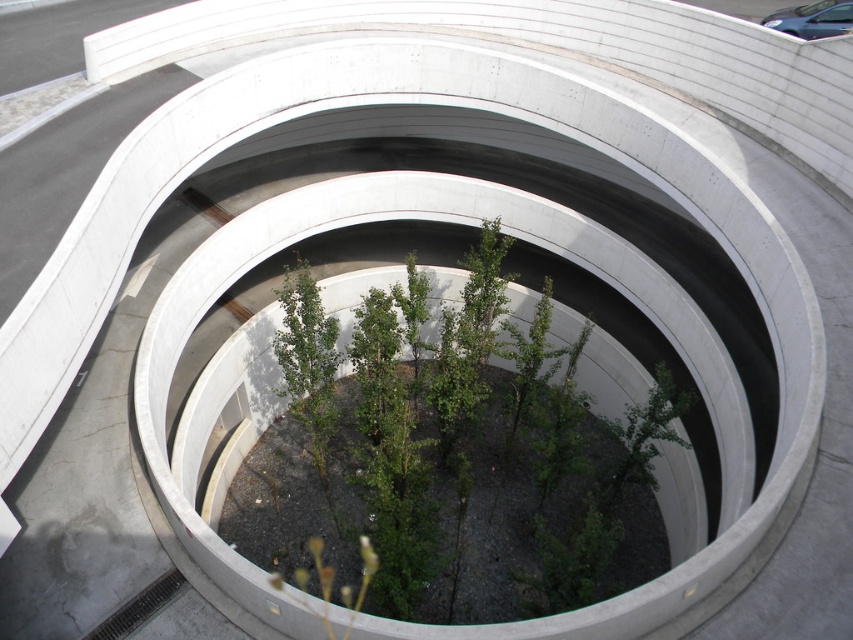
Question: Among these points, which one is farthest from the camera?

Choices:
 (A) (381, 326)
 (B) (809, 29)

Answer: (B)

Question: Does green leafy plant at center appear on the right side of metallic gray car at upper right?

Choices:
 (A) yes
 (B) no

Answer: (B)

Question: Among these points, which one is nearest to the camera?

Choices:
 (A) (486, 593)
 (B) (804, 6)

Answer: (A)

Question: Is green leafy plant at center in front of metallic gray car at upper right?

Choices:
 (A) yes
 (B) no

Answer: (A)

Question: Is green leafy plant at center below metallic gray car at upper right?

Choices:
 (A) no
 (B) yes

Answer: (B)